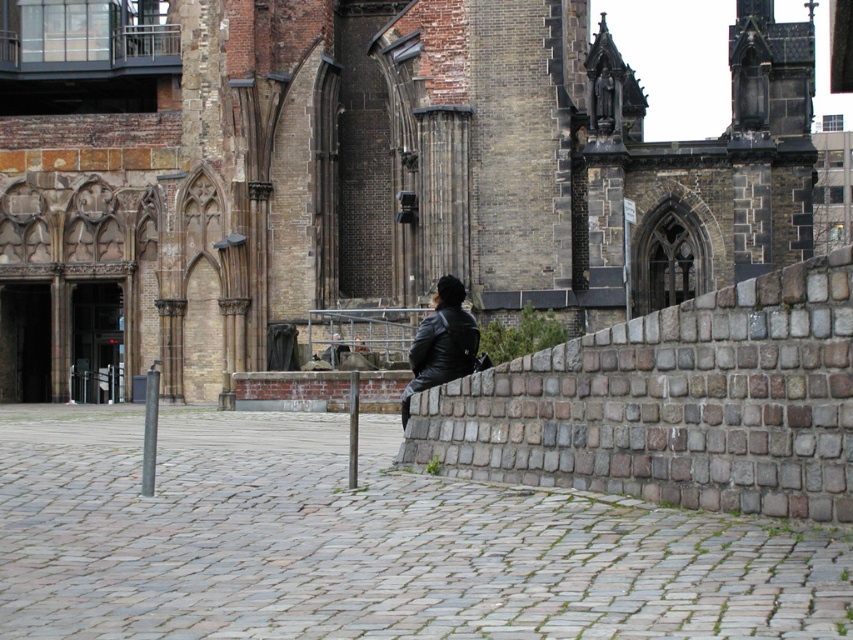
You are standing in the plaza in front of the historic building. You notice two objects at the center of the image. Which one is taller, the brown stone church at center or the black leather jacket at center?

The brown stone church at center is taller than the black leather jacket at center according to the description.

You are standing in the plaza in front of the brown stone church at center. You notice a black leather jacket at center lying on the ground. If you want to pick up the jacket without moving closer to the church, which direction should you move?

Since the brown stone church at center is wider than the black leather jacket at center, you should move to the side opposite of the church to pick up the jacket without getting closer to it.

You are standing in the plaza in front of the historic building. You notice two points marked on the curved brick wall on the right side of the image. The first point is at coordinates point (x=235, y=289) and the second is at point (x=468, y=368). Which of these points is closer to you as you face the building?

Point (x=235, y=289) is closer to you because it is further to the viewer than point (x=468, y=368).